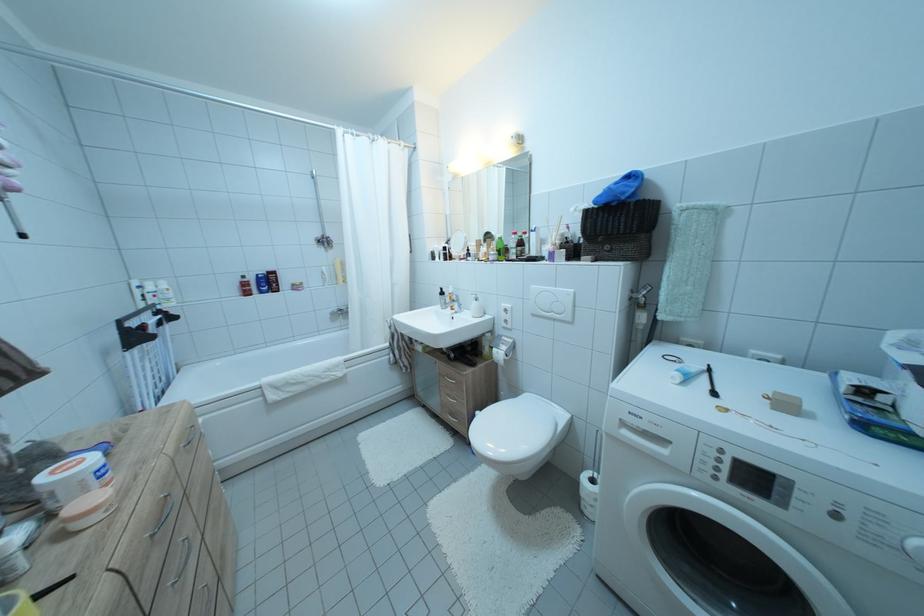
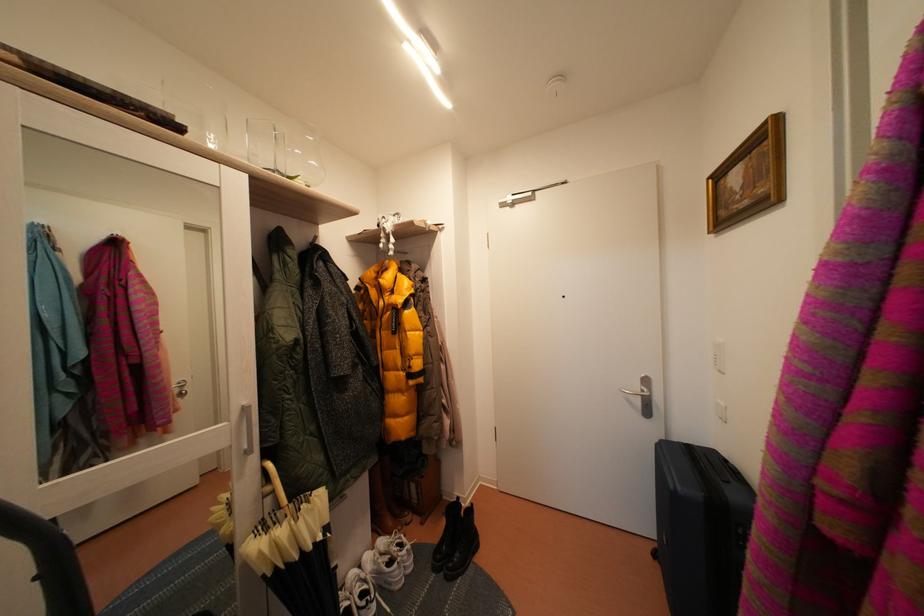
Question: How did the camera likely rotate?

Choices:
 (A) Left
 (B) Right
 (C) Up
 (D) Down

Answer: (B)